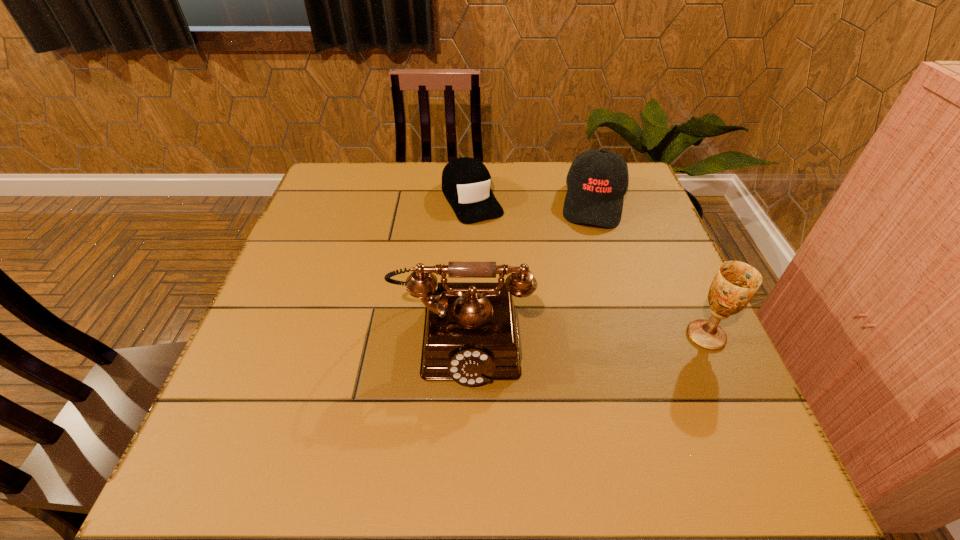
Image resolution: width=960 pixels, height=540 pixels. I want to click on vacant space in between the baseball cap and the shortest object, so click(533, 201).

Locate an element on the screen. This screenshot has width=960, height=540. object that stands as the third closest to the cap is located at coordinates (735, 283).

Identify which object is the second nearest to the tallest object. Please provide its 2D coordinates. Your answer should be formatted as a tuple, i.e. [(x, y)], where the tuple contains the x and y coordinates of a point satisfying the conditions above.

[(597, 180)]

I want to click on free spot that satisfies the following two spatial constraints: 1. on the dial of the tallest object; 2. on the right side of the chalice, so click(x=461, y=335).

Image resolution: width=960 pixels, height=540 pixels. Identify the location of free location that satisfies the following two spatial constraints: 1. on the front side of the chalice; 2. on the right side of the third object from left to right. (636, 335).

Image resolution: width=960 pixels, height=540 pixels. Identify the location of vacant space that satisfies the following two spatial constraints: 1. on the front side of the cap; 2. on the right side of the second tallest object. (468, 335).